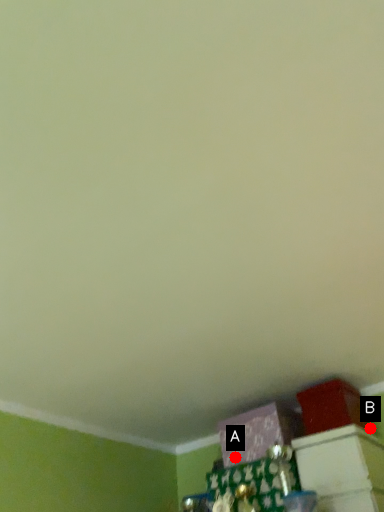
Question: Two points are circled on the image, labeled by A and B beside each circle. Which of the following is the closest to the observer?

Choices:
 (A) A is closer
 (B) B is closer

Answer: (B)